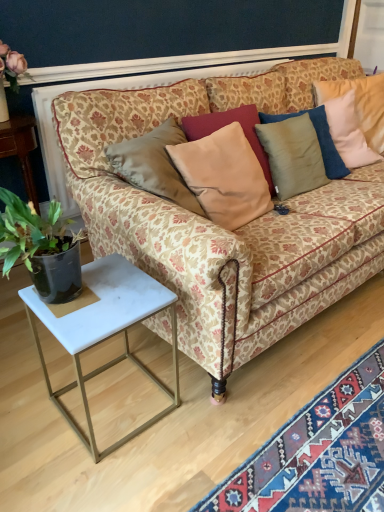
Question: From the image's perspective, would you say carpet with intricate patterns at lower right is positioned over satin beige pillow at center?

Choices:
 (A) no
 (B) yes

Answer: (A)

Question: Is carpet with intricate patterns at lower right behind satin beige pillow at center?

Choices:
 (A) no
 (B) yes

Answer: (A)

Question: Would you consider carpet with intricate patterns at lower right to be distant from satin beige pillow at center?

Choices:
 (A) yes
 (B) no

Answer: (B)

Question: Is carpet with intricate patterns at lower right positioned with its back to satin beige pillow at center?

Choices:
 (A) yes
 (B) no

Answer: (B)

Question: Can you confirm if carpet with intricate patterns at lower right is positioned to the right of satin beige pillow at center?

Choices:
 (A) no
 (B) yes

Answer: (B)

Question: From a real-world perspective, is carpet with intricate patterns at lower right positioned under satin beige pillow at center based on gravity?

Choices:
 (A) no
 (B) yes

Answer: (B)

Question: Are green leafy plant at left and patterned fabric couch at center located far from each other?

Choices:
 (A) yes
 (B) no

Answer: (B)

Question: Does green leafy plant at left touch patterned fabric couch at center?

Choices:
 (A) yes
 (B) no

Answer: (B)

Question: From a real-world perspective, is green leafy plant at left located beneath patterned fabric couch at center?

Choices:
 (A) no
 (B) yes

Answer: (B)

Question: From a real-world perspective, is green leafy plant at left on patterned fabric couch at center?

Choices:
 (A) yes
 (B) no

Answer: (B)

Question: Is green leafy plant at left located outside patterned fabric couch at center?

Choices:
 (A) yes
 (B) no

Answer: (A)

Question: Would you say patterned fabric couch at center is part of green leafy plant at left's contents?

Choices:
 (A) yes
 (B) no

Answer: (B)

Question: Considering the relative sizes of white marble side table at lower left and satin beige pillow at center in the image provided, is white marble side table at lower left smaller than satin beige pillow at center?

Choices:
 (A) no
 (B) yes

Answer: (A)